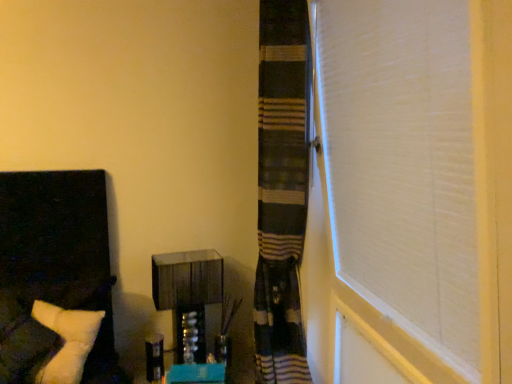
Question: Considering the positions of metallic glass vanity at center and white soft pillow at left in the image, is metallic glass vanity at center taller or shorter than white soft pillow at left?

Choices:
 (A) tall
 (B) short

Answer: (B)

Question: In the image, is metallic glass vanity at center positioned in front of or behind white soft pillow at left?

Choices:
 (A) front
 (B) behind

Answer: (B)

Question: From a real-world perspective, is metallic glass vanity at center physically located above or below white soft pillow at left?

Choices:
 (A) above
 (B) below

Answer: (B)

Question: In the image, is white soft pillow at left on the left side or the right side of metallic glass vanity at center?

Choices:
 (A) right
 (B) left

Answer: (B)

Question: From the image's perspective, is white soft pillow at left above or below metallic glass vanity at center?

Choices:
 (A) above
 (B) below

Answer: (A)

Question: From a real-world perspective, is white soft pillow at left physically located above or below metallic glass vanity at center?

Choices:
 (A) below
 (B) above

Answer: (B)

Question: In terms of size, does white soft pillow at left appear bigger or smaller than metallic glass vanity at center?

Choices:
 (A) small
 (B) big

Answer: (B)